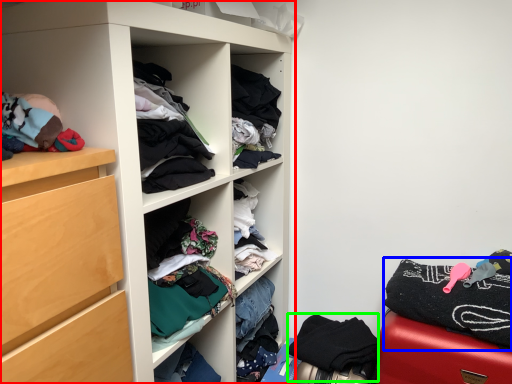
Question: Considering the real-world distances, which object is closest to cupboard (highlighted by a red box)? clothing (highlighted by a blue box) or clothing (highlighted by a green box).

Choices:
 (A) clothing
 (B) clothing

Answer: (B)